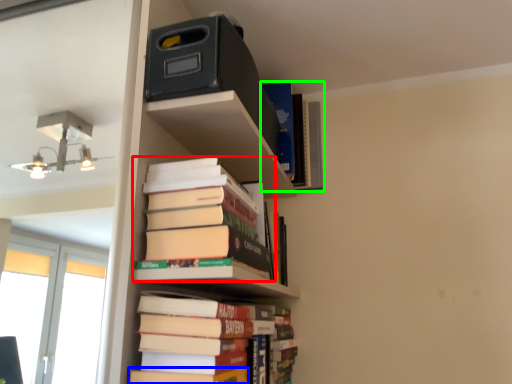
Question: Which object is positioned closest to book (highlighted by a red box)? Select from paperback book (highlighted by a blue box) and book (highlighted by a green box).

Choices:
 (A) paperback book
 (B) book

Answer: (A)